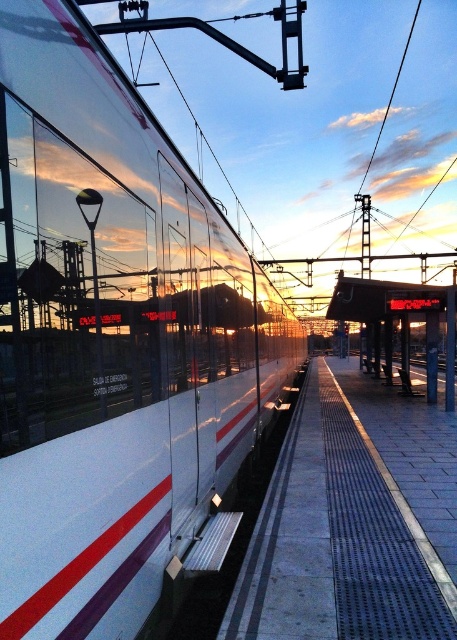
You are a passenger waiting on the smooth concrete platform at center. You want to board the white glossy train at center. Considering the size difference between the two, will the train have enough space to accommodate all passengers on the platform?

The white glossy train at center is larger in size than the smooth concrete platform at center, so yes, the train has sufficient space to accommodate all passengers on the platform.

You are a traveler at the train station and need to board the train. You see the smooth concrete platform at center and the metallic platform at center. Which platform should you stand on to board the train?

The smooth concrete platform at center has a smaller size compared to the metallic platform at center. Therefore, you should stand on the metallic platform at center since it is larger and more likely to be the boarding platform for the train.

From the picture: You are standing on the smooth concrete platform at center and want to walk to the metallic platform at center. In which direction should you move?

You should move to your right because the smooth concrete platform at center is to the left of the metallic platform at center.